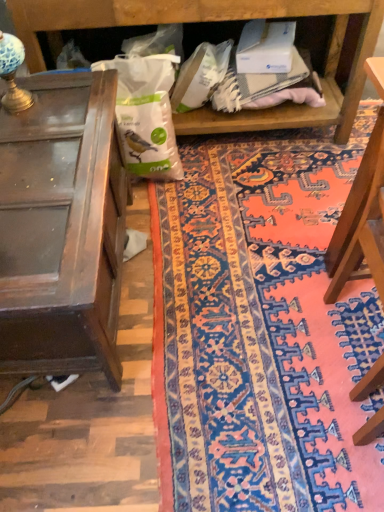
Question: From the image's perspective, is wooden table at left on top of wooden chair at right?

Choices:
 (A) yes
 (B) no

Answer: (A)

Question: From the image's perspective, is wooden table at left located beneath wooden chair at right?

Choices:
 (A) yes
 (B) no

Answer: (B)

Question: Is wooden table at left bigger than wooden chair at right?

Choices:
 (A) no
 (B) yes

Answer: (B)

Question: Is wooden table at left oriented towards wooden chair at right?

Choices:
 (A) no
 (B) yes

Answer: (B)

Question: Is wooden table at left not within wooden chair at right?

Choices:
 (A) no
 (B) yes

Answer: (B)

Question: Does wooden table at left have a greater height compared to wooden chair at right?

Choices:
 (A) yes
 (B) no

Answer: (B)

Question: Is wooden chair at right looking in the opposite direction of white matte paper bag at center?

Choices:
 (A) yes
 (B) no

Answer: (B)

Question: From the image's perspective, is wooden chair at right under white matte paper bag at center?

Choices:
 (A) no
 (B) yes

Answer: (B)

Question: Is wooden chair at right bigger than white matte paper bag at center?

Choices:
 (A) no
 (B) yes

Answer: (B)

Question: From a real-world perspective, does wooden chair at right stand above white matte paper bag at center?

Choices:
 (A) no
 (B) yes

Answer: (B)

Question: Considering the relative sizes of wooden chair at right and white matte paper bag at center in the image provided, is wooden chair at right shorter than white matte paper bag at center?

Choices:
 (A) yes
 (B) no

Answer: (B)

Question: Can white matte paper bag at center be found inside wooden chair at right?

Choices:
 (A) yes
 (B) no

Answer: (B)

Question: Can you confirm if white matte paper bag at center is wider than wooden chair at right?

Choices:
 (A) yes
 (B) no

Answer: (B)